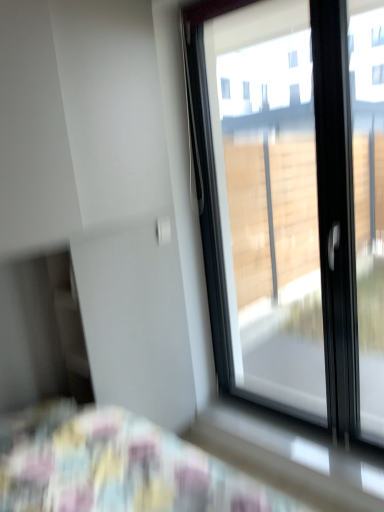
Where is `white glossy window sill at lower right`? This screenshot has height=512, width=384. white glossy window sill at lower right is located at coordinates (291, 456).

This screenshot has width=384, height=512. What do you see at coordinates (291, 456) in the screenshot? I see `white glossy window sill at lower right` at bounding box center [291, 456].

Where is `white glossy window sill at lower right`? Image resolution: width=384 pixels, height=512 pixels. white glossy window sill at lower right is located at coordinates (x=291, y=456).